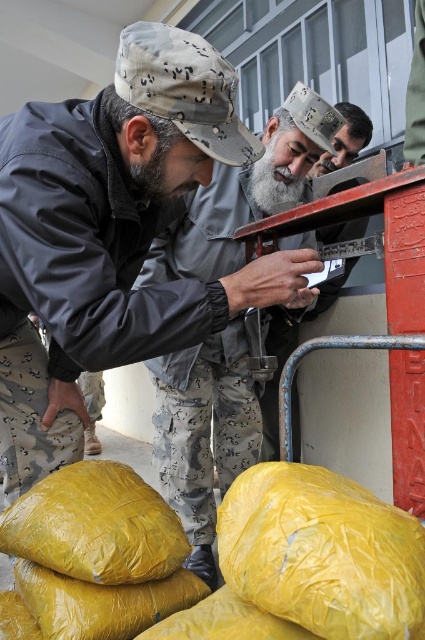
Question: Can you confirm if yellow plastic sack at lower left is positioned to the left of graywoollybeard at center?

Choices:
 (A) yes
 (B) no

Answer: (A)

Question: Where is camouflage fabric uniform at center located in relation to yellow plastic sack at lower left in the image?

Choices:
 (A) left
 (B) right

Answer: (B)

Question: Can you confirm if camouflage fabric uniform at center is smaller than graywoollybeard at center?

Choices:
 (A) no
 (B) yes

Answer: (A)

Question: Considering the real-world distances, which object is closest to the graywoollybeard at center?

Choices:
 (A) bearded man at center
 (B) yellow plastic sack at lower left
 (C) camouflage fabric uniform at center

Answer: (C)

Question: Among these points, which one is nearest to the camera?

Choices:
 (A) (306, 163)
 (B) (81, 568)
 (C) (309, 301)

Answer: (B)

Question: Which point is farther to the camera?

Choices:
 (A) bearded man at center
 (B) graywoollybeard at center
 (C) camouflage fabric uniform at center

Answer: (A)